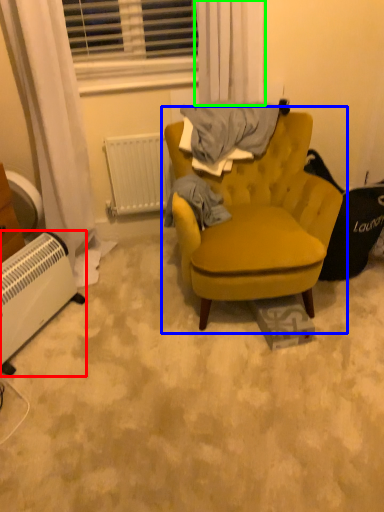
Question: Estimate the real-world distances between objects in this image. Which object is closer to radiator (highlighted by a red box), chair (highlighted by a blue box) or curtain (highlighted by a green box)?

Choices:
 (A) chair
 (B) curtain

Answer: (A)